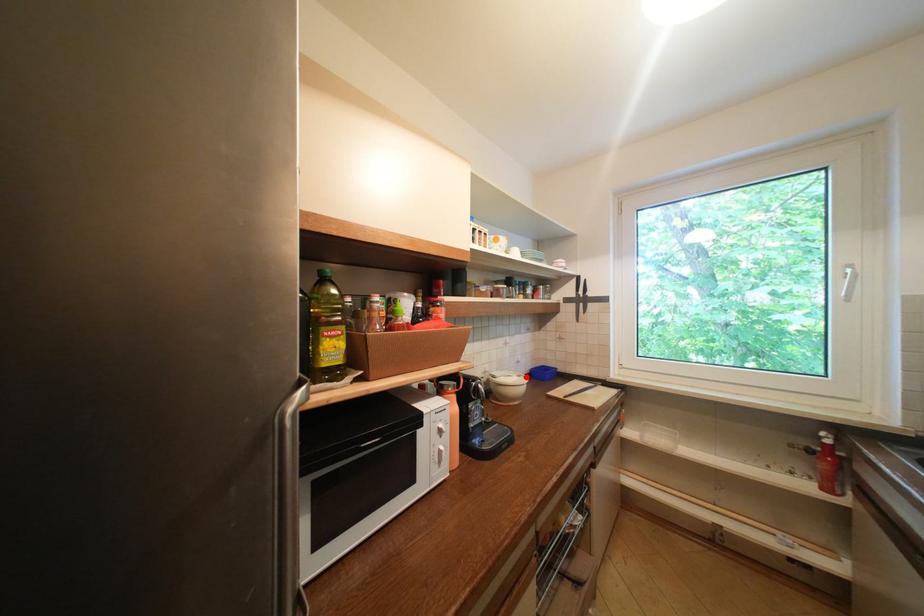
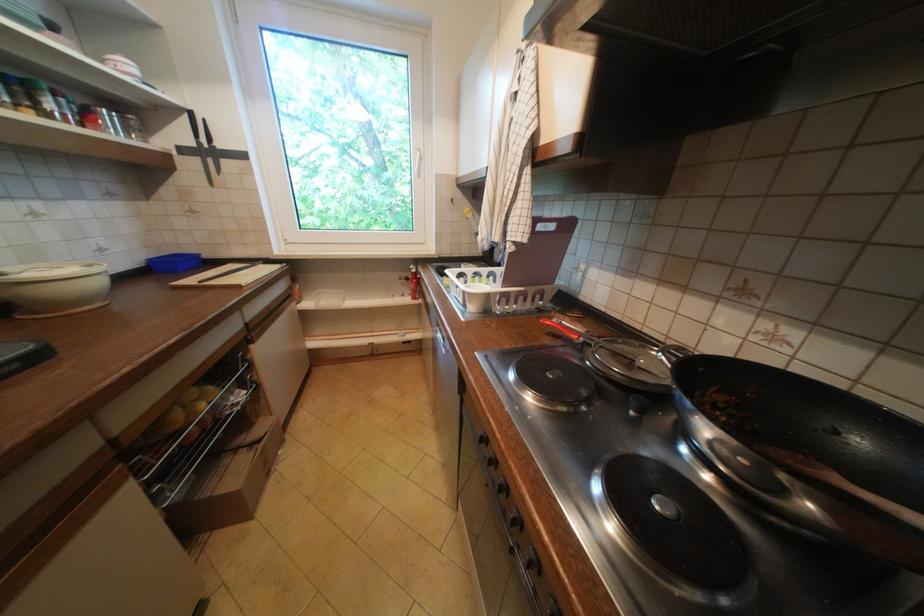
The point at the highlighted location is marked in the first image. Where is the corresponding point in the second image?

(91, 267)